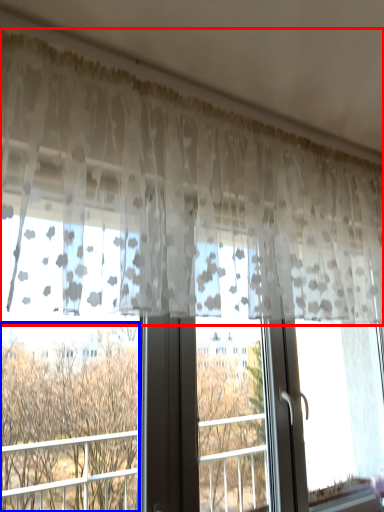
Question: Which object appears farthest to the camera in this image, curtain (highlighted by a red box) or tree (highlighted by a blue box)?

Choices:
 (A) curtain
 (B) tree

Answer: (B)